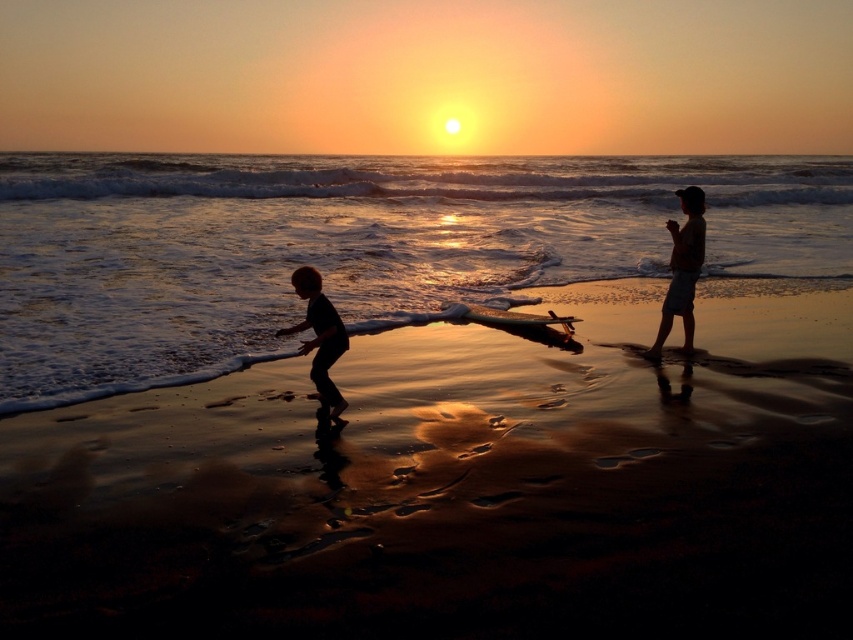
Question: Which object is the farthest from the shiny sand at lower center?

Choices:
 (A) reflective wet sand at lower center
 (B) silhouette sand at right
 (C) silhouette child at lower left

Answer: (A)

Question: Observing the image, what is the correct spatial positioning of reflective wet sand at lower center in reference to silhouette sand at right?

Choices:
 (A) above
 (B) below

Answer: (A)

Question: Is reflective wet sand at lower center smaller than silhouette sand at right?

Choices:
 (A) no
 (B) yes

Answer: (A)

Question: Which of these objects is positioned closest to the reflective wet sand at lower center?

Choices:
 (A) silhouette child at lower left
 (B) silhouette sand at right
 (C) shiny sand at lower center

Answer: (A)

Question: Does reflective wet sand at lower center appear on the right side of silhouette sand at right?

Choices:
 (A) yes
 (B) no

Answer: (A)

Question: Considering the real-world distances, which object is closest to the silhouette sand at right?

Choices:
 (A) reflective wet sand at lower center
 (B) shiny sand at lower center
 (C) silhouette child at lower left

Answer: (C)